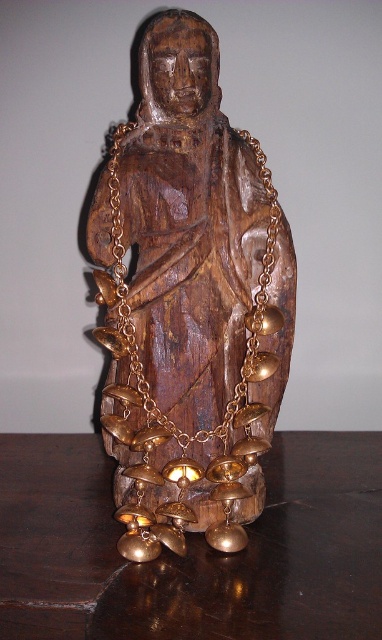
Question: Is wooden statue at center further to the viewer compared to shiny dark wood table at center?

Choices:
 (A) yes
 (B) no

Answer: (A)

Question: Among these objects, which one is nearest to the camera?

Choices:
 (A) shiny dark wood table at center
 (B) wooden statue at center

Answer: (A)

Question: Is wooden statue at center smaller than shiny dark wood table at center?

Choices:
 (A) yes
 (B) no

Answer: (A)

Question: Which object appears closest to the camera in this image?

Choices:
 (A) wooden statue at center
 (B) shiny dark wood table at center

Answer: (B)

Question: Which object appears farthest from the camera in this image?

Choices:
 (A) wooden statue at center
 (B) shiny dark wood table at center

Answer: (A)

Question: Is wooden statue at center wider than shiny dark wood table at center?

Choices:
 (A) no
 (B) yes

Answer: (A)